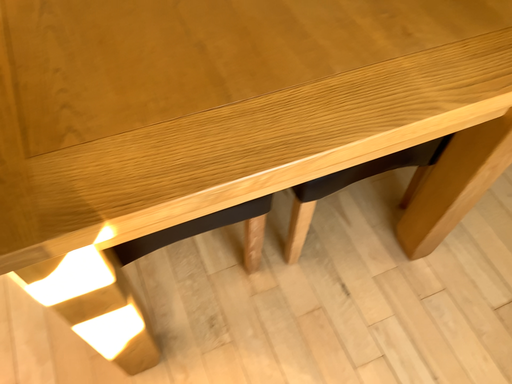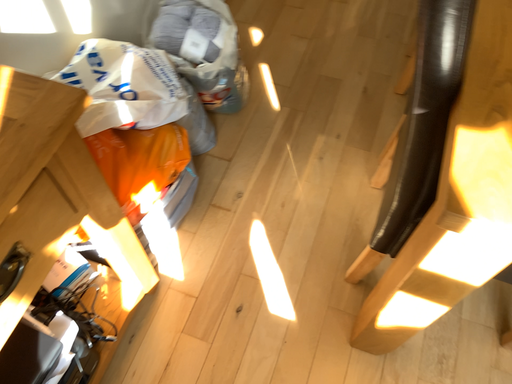
Question: How did the camera likely rotate when shooting the video?

Choices:
 (A) rotated right
 (B) rotated left

Answer: (B)